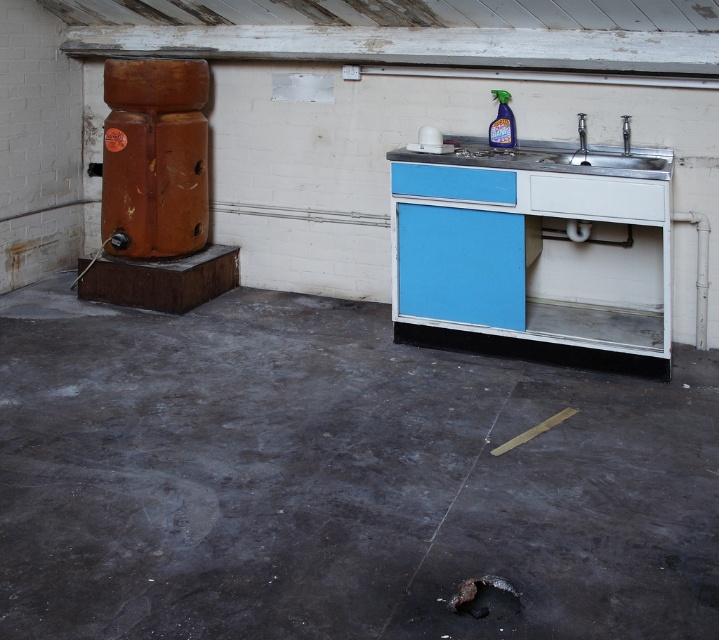
Question: Based on their relative distances, which object is nearer to the silver metallic faucet at right?

Choices:
 (A) stainless steel sink at right
 (B) stainless steel sink at upper right
 (C) metallic faucet at right
 (D) translucent plastic spray bottle at upper center

Answer: (C)

Question: Is stainless steel sink at right positioned in front of stainless steel sink at upper right?

Choices:
 (A) yes
 (B) no

Answer: (B)

Question: Among these points, which one is farthest from the camera?

Choices:
 (A) tap(508, 196)
 (B) tap(505, 92)
 (C) tap(580, 140)

Answer: (B)

Question: Does stainless steel sink at upper right appear on the left side of translucent plastic spray bottle at upper center?

Choices:
 (A) no
 (B) yes

Answer: (A)

Question: Is stainless steel sink at right smaller than metallic faucet at right?

Choices:
 (A) yes
 (B) no

Answer: (B)

Question: Which point is closer to the camera?

Choices:
 (A) stainless steel sink at upper right
 (B) silver metallic faucet at right
 (C) stainless steel sink at right

Answer: (A)